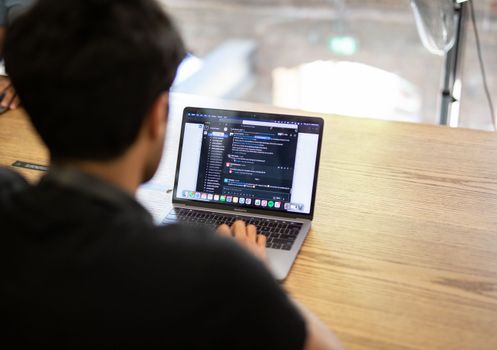
At what (x,y) coordinates should I click in order to perform the action: click on table surface. Please return your answer as a coordinate pair (x, y). The image size is (497, 350). Looking at the image, I should click on (378, 203).